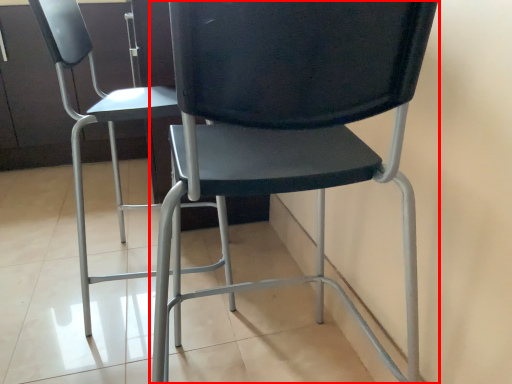
Question: Where is chair (annotated by the red box) located in relation to chair in the image?

Choices:
 (A) left
 (B) right

Answer: (B)